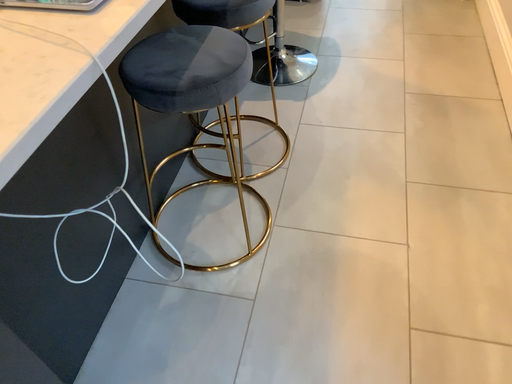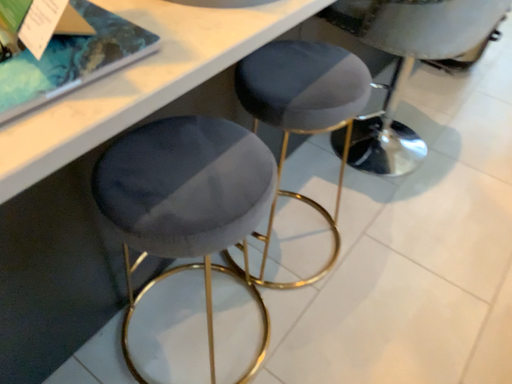
Question: How did the camera likely rotate when shooting the video?

Choices:
 (A) rotated right
 (B) rotated left

Answer: (B)